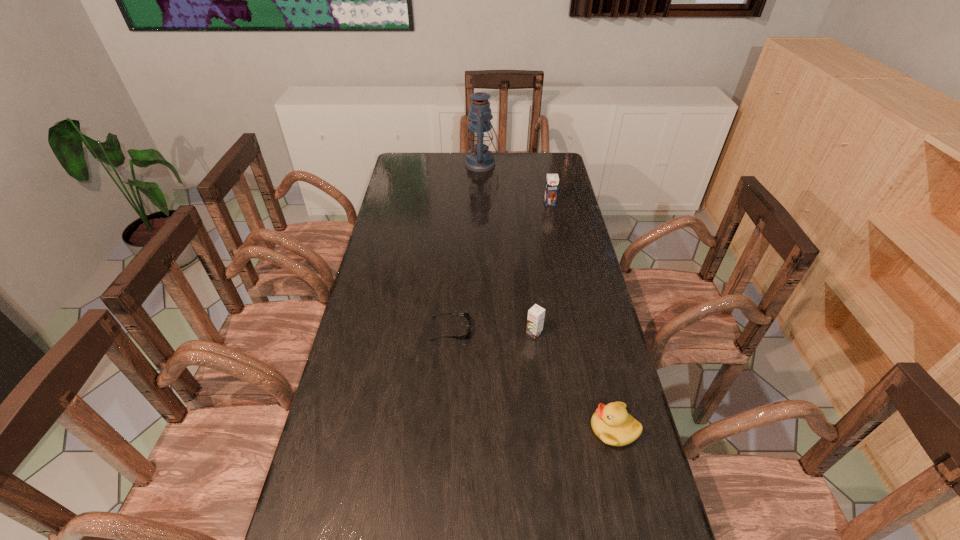
At what (x,y) coordinates should I click in order to perform the action: click on the tallest object. Please return your answer as a coordinate pair (x, y). Looking at the image, I should click on (479, 159).

The height and width of the screenshot is (540, 960). Identify the location of the farthest object. (479, 159).

The height and width of the screenshot is (540, 960). I want to click on the fourth shortest object, so coord(552,180).

Locate an element on the screen. The width and height of the screenshot is (960, 540). the farther chocolate milk is located at coordinates (552, 180).

Where is `the third object from right to left`? The width and height of the screenshot is (960, 540). the third object from right to left is located at coordinates (536, 314).

Identify the location of the nearer chocolate milk. (536, 314).

I want to click on the nearest object, so click(611, 423).

Find the location of a particular element. duckling is located at coordinates (611, 423).

Where is `the shortest object`? The height and width of the screenshot is (540, 960). the shortest object is located at coordinates (465, 314).

This screenshot has height=540, width=960. What are the coordinates of `free spot located on the front-facing side of the lantern` in the screenshot? It's located at (440, 164).